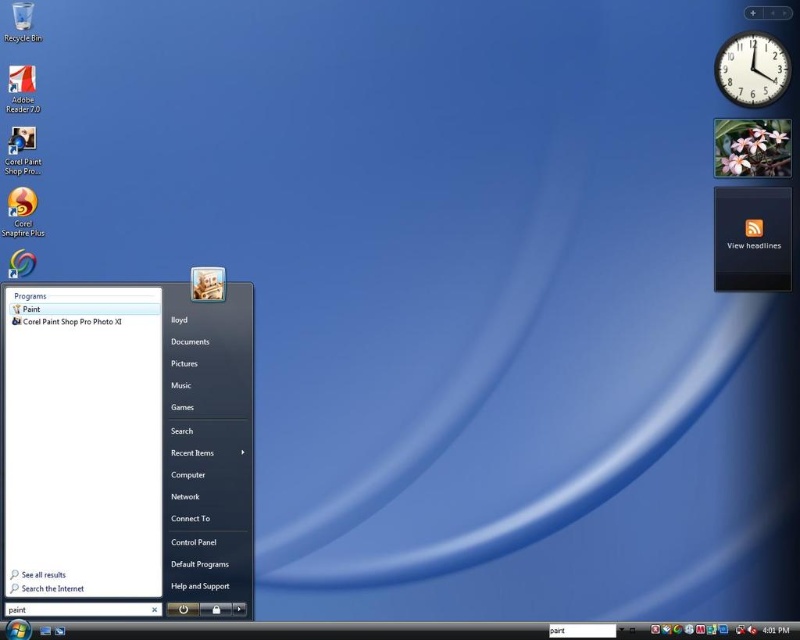
From the picture: Who is taller, white matte menu at center or black plastic clock at upper right?

With more height is white matte menu at center.

Can you confirm if white matte menu at center is wider than black plastic clock at upper right?

Yes.

The image size is (800, 640). Describe the element at coordinates (126, 451) in the screenshot. I see `white matte menu at center` at that location.

Find the location of a particular element. white matte menu at center is located at coordinates (126, 451).